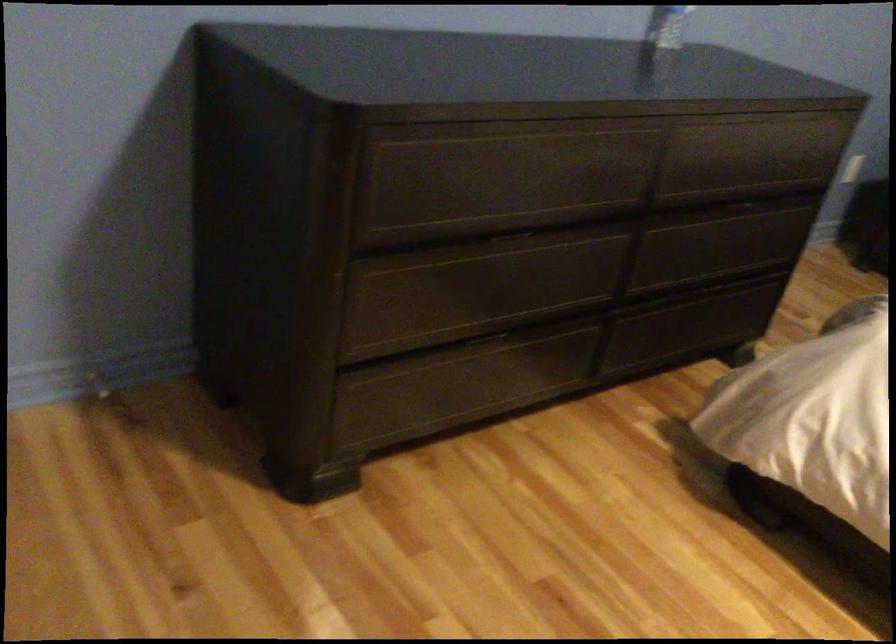
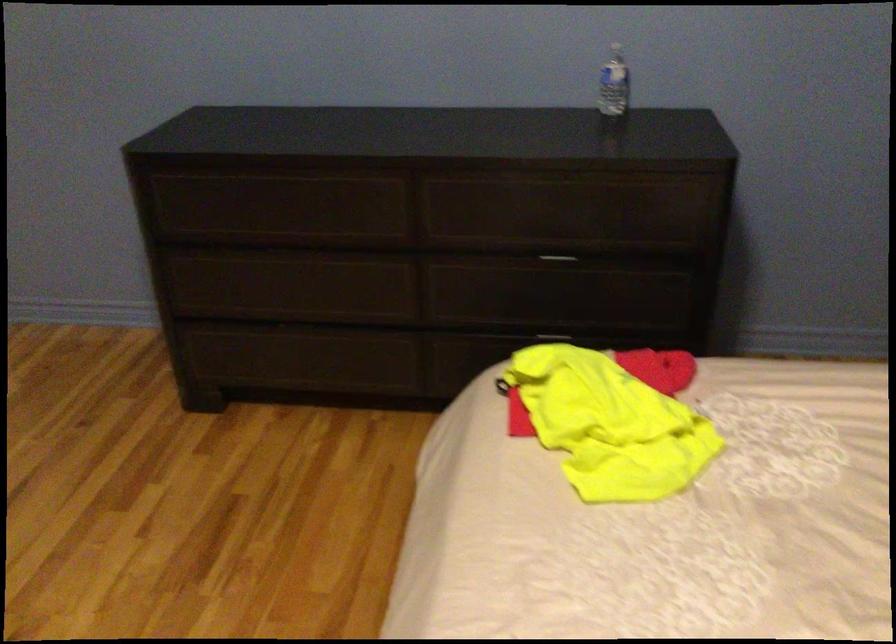
The point at (x=748, y=203) is marked in the first image. Where is the corresponding point in the second image?

(557, 260)